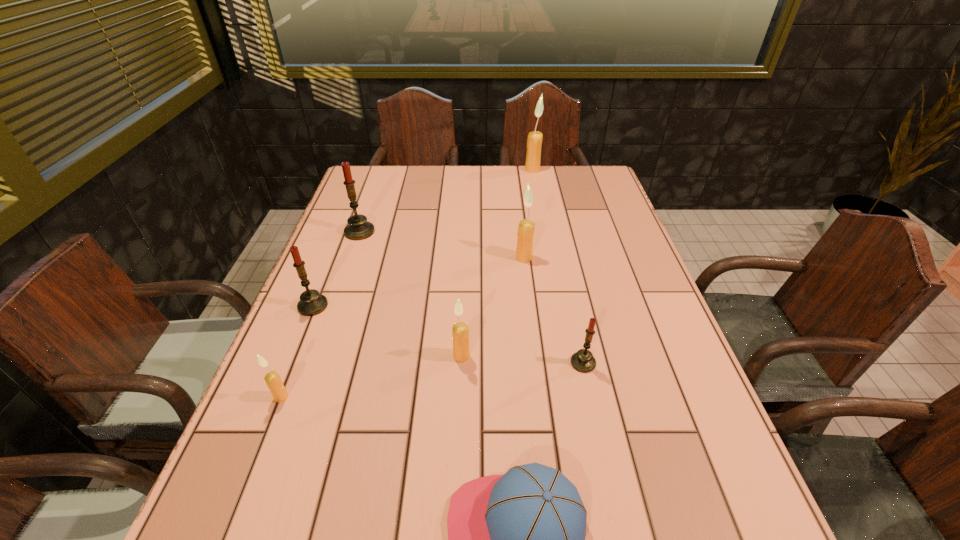
This screenshot has height=540, width=960. Identify the location of the closest red candle relative to the blue baseball cap. (583, 361).

Where is `vacant space that satisfies the following two spatial constraints: 1. on the back side of the second nearest object; 2. on the left side of the farthest object`? vacant space that satisfies the following two spatial constraints: 1. on the back side of the second nearest object; 2. on the left side of the farthest object is located at coordinates (371, 170).

I want to click on vacant region that satisfies the following two spatial constraints: 1. on the front side of the tallest candle; 2. on the right side of the nearest red candle, so click(x=569, y=363).

At what (x,y) coordinates should I click in order to perform the action: click on vacant area in the image that satisfies the following two spatial constraints: 1. on the front side of the second farthest object; 2. on the left side of the second farthest cream candle. Please return your answer as a coordinate pair (x, y). The width and height of the screenshot is (960, 540). Looking at the image, I should click on (350, 258).

You are a GUI agent. You are given a task and a screenshot of the screen. Output one action in this format:
    pyautogui.click(x=<x>, y=<y>)
    Task: Click on the free space that satisfies the following two spatial constraints: 1. on the front side of the biggest cream candle; 2. on the right side of the rightmost red candle
    The height and width of the screenshot is (540, 960).
    Given the screenshot: What is the action you would take?
    pyautogui.click(x=569, y=363)